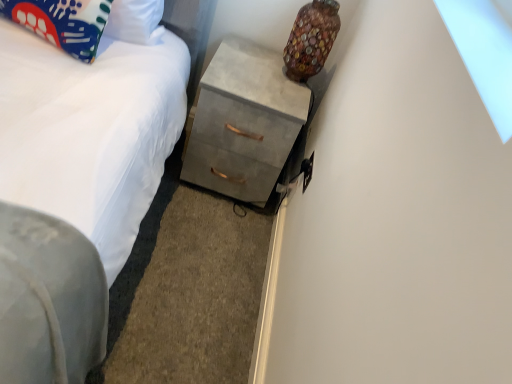
Where is `blank space above white fabric bed at lower left (from a real-world perspective)`? The image size is (512, 384). blank space above white fabric bed at lower left (from a real-world perspective) is located at coordinates (187, 251).